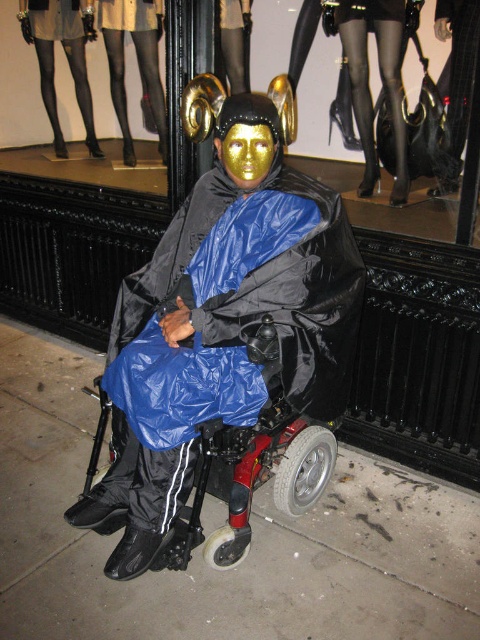
Does point (169, 353) come closer to viewer compared to point (239, 28)?

Yes, point (169, 353) is in front of point (239, 28).

Who is shorter, shiny gold mask at center or black leather boots at center?

With less height is black leather boots at center.

Is point (243, 280) farther from viewer compared to point (244, 67)?

No, it is in front of (244, 67).

Where is `shiny gold mask at center`? This screenshot has height=640, width=480. shiny gold mask at center is located at coordinates (220, 333).

Who is taller, black tights at upper left or gold glitter mask at center?

black tights at upper left is taller.

The width and height of the screenshot is (480, 640). What do you see at coordinates (66, 56) in the screenshot?
I see `black tights at upper left` at bounding box center [66, 56].

This screenshot has width=480, height=640. I want to click on black tights at upper left, so click(x=66, y=56).

This screenshot has width=480, height=640. Find the location of `black tights at upper left`. black tights at upper left is located at coordinates (x=66, y=56).

Who is more distant from viewer, (269, 353) or (39, 67)?

The point (39, 67) is more distant.

Is metallic red wheelchair at center thinner than black tights at upper left?

No.

Find the location of a particular element. Image resolution: width=480 pixels, height=640 pixels. metallic red wheelchair at center is located at coordinates (253, 467).